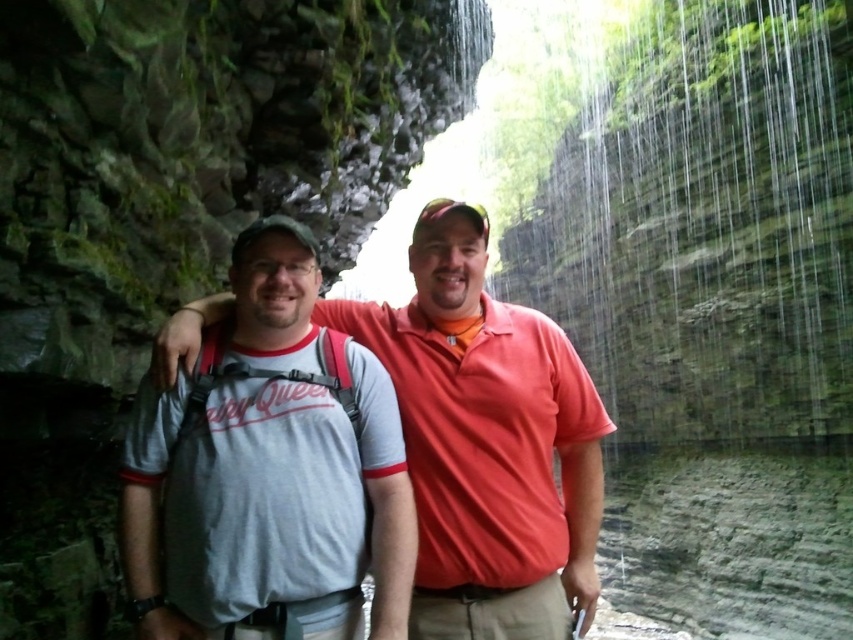
Question: Does green mossy rock at upper center have a larger size compared to gray cotton t-shirt at center?

Choices:
 (A) yes
 (B) no

Answer: (A)

Question: Can you confirm if green mossy rock at upper center is smaller than gray cotton t-shirt at center?

Choices:
 (A) no
 (B) yes

Answer: (A)

Question: Is green mossy rock at upper center to the right of gray cotton t-shirt at center from the viewer's perspective?

Choices:
 (A) no
 (B) yes

Answer: (B)

Question: Which object appears closest to the camera in this image?

Choices:
 (A) green mossy rock at upper center
 (B) gray cotton t-shirt at center

Answer: (B)

Question: Which object is farther from the camera taking this photo?

Choices:
 (A) green mossy rock at upper center
 (B) gray cotton t-shirt at center

Answer: (A)